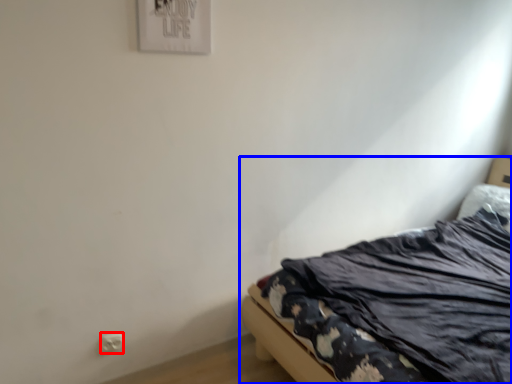
Question: Which point is further to the camera, electric outlet (highlighted by a red box) or bed (highlighted by a blue box)?

Choices:
 (A) electric outlet
 (B) bed

Answer: (A)